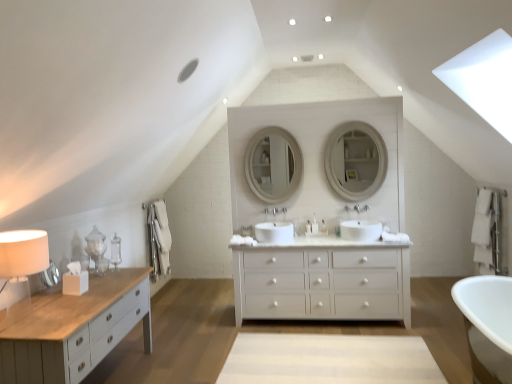
Question: Based on their sizes in the image, would you say white glossy mirror at center, the first mirror in the left-to-right sequence, is bigger or smaller than white matte chest of drawers at center?

Choices:
 (A) small
 (B) big

Answer: (A)

Question: In the image, is white glossy mirror at center, the first mirror in the left-to-right sequence, positioned in front of or behind white matte chest of drawers at center?

Choices:
 (A) behind
 (B) front

Answer: (A)

Question: Based on their relative distances, which object is farther from the white fabric lampshade at left?

Choices:
 (A) white glossy toiletry at center, the 2th toiletry in the right-to-left sequence
 (B) white matte chest of drawers at center
 (C) white glossy sink at center, the 1th sink in the left-to-right sequence
 (D) matte white mirror at center, the 2th mirror in the left-to-right sequence
 (E) white glossy sink at center, which is the second sink in left-to-right order

Answer: (D)

Question: Estimate the real-world distances between objects in this image. Which object is farther from the clear plastic bottle at center, which is the first toiletry in right-to-left order?

Choices:
 (A) white glossy mirror at center, the first mirror in the left-to-right sequence
 (B) white glossy sink at center, which is the second sink in left-to-right order
 (C) white glossy sink at center, the 1th sink in the left-to-right sequence
 (D) white fabric lampshade at left
 (E) white glossy faucet at center, the second faucet positioned from the right

Answer: (D)